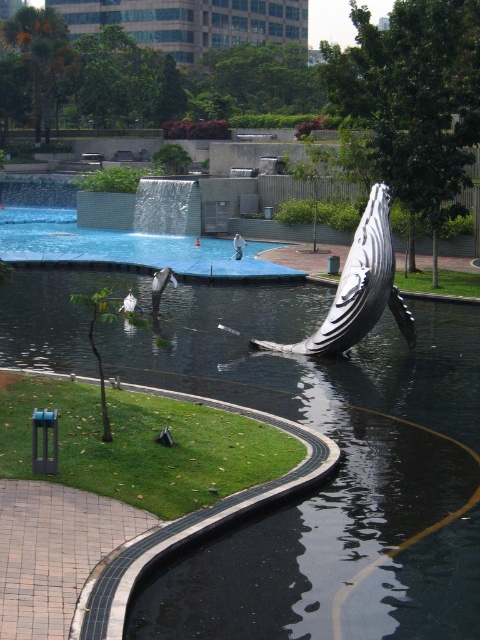
Between blue glossy pond at center and zebra-striped sculpture at center, which one has more height?

With more height is blue glossy pond at center.

The height and width of the screenshot is (640, 480). What are the coordinates of `blue glossy pond at center` in the screenshot? It's located at (126, 246).

Which is in front, point (192, 308) or point (384, 259)?

Point (384, 259)

Does black glossy pool at center appear under zebra-striped sculpture at center?

Correct, black glossy pool at center is located below zebra-striped sculpture at center.

Between point (414, 621) and point (386, 234), which one is positioned behind?

Point (386, 234)

The image size is (480, 640). What are the coordinates of `black glossy pool at center` in the screenshot? It's located at (319, 429).

Which is more to the left, black glossy pool at center or blue glossy pond at center?

blue glossy pond at center

In the scene shown: Is black glossy pool at center above blue glossy pond at center?

No, black glossy pool at center is not above blue glossy pond at center.

Find the location of a particular element. This screenshot has height=640, width=480. black glossy pool at center is located at coordinates (319, 429).